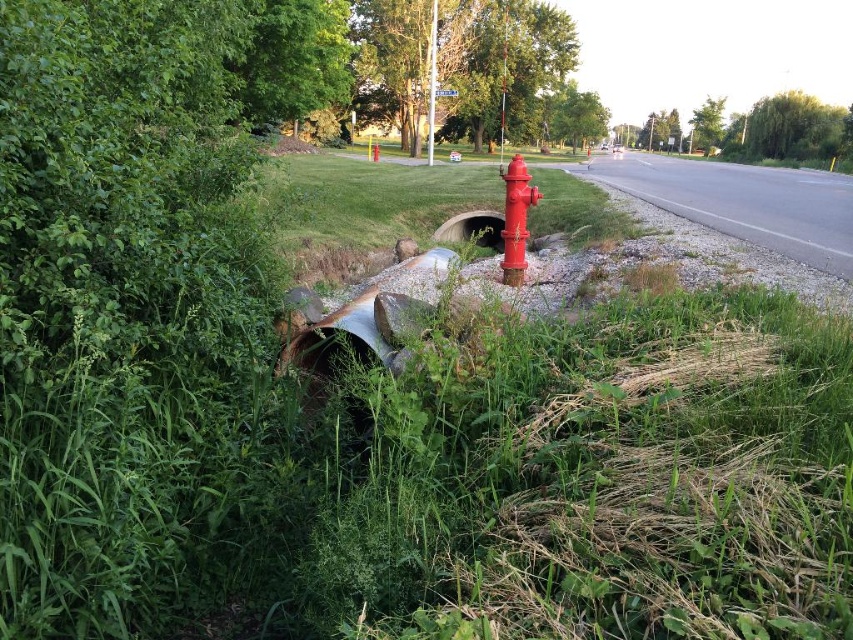
Question: Where is shiny red fire hydrant at center located in relation to rusty metal pipe at center in the image?

Choices:
 (A) below
 (B) above

Answer: (B)

Question: Is shiny red fire hydrant at center further to the viewer compared to rusty metal pipe at center?

Choices:
 (A) yes
 (B) no

Answer: (B)

Question: Is shiny red fire hydrant at center below rusty metal pipe at center?

Choices:
 (A) no
 (B) yes

Answer: (A)

Question: Which point is farther to the camera?

Choices:
 (A) (508, 278)
 (B) (480, 241)

Answer: (B)

Question: Which of the following is the closest to the observer?

Choices:
 (A) rusty metal pipe at center
 (B) shiny red fire hydrant at center

Answer: (B)

Question: Which of the following is the farthest from the observer?

Choices:
 (A) (445, 230)
 (B) (508, 250)

Answer: (A)